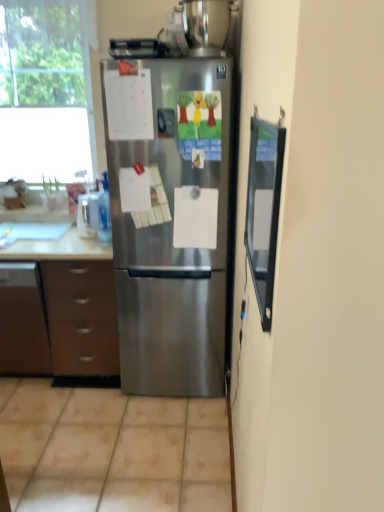
This screenshot has width=384, height=512. Find the location of `free location in front of white glossy sink at left`. free location in front of white glossy sink at left is located at coordinates (26, 245).